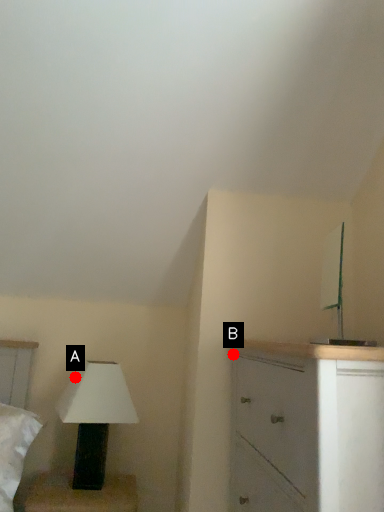
Question: Two points are circled on the image, labeled by A and B beside each circle. Which point appears farthest from the camera in this image?

Choices:
 (A) A is further
 (B) B is further

Answer: (A)